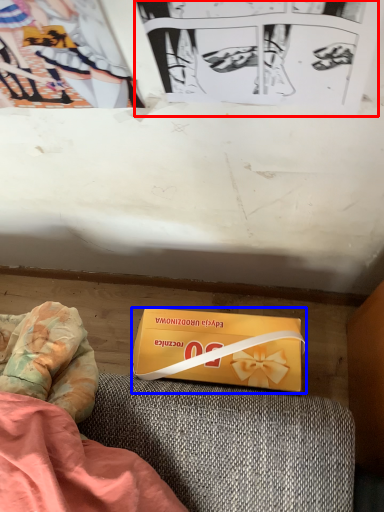
Question: Which point is closer to the camera, paperback book (highlighted by a red box) or box (highlighted by a blue box)?

Choices:
 (A) paperback book
 (B) box

Answer: (A)